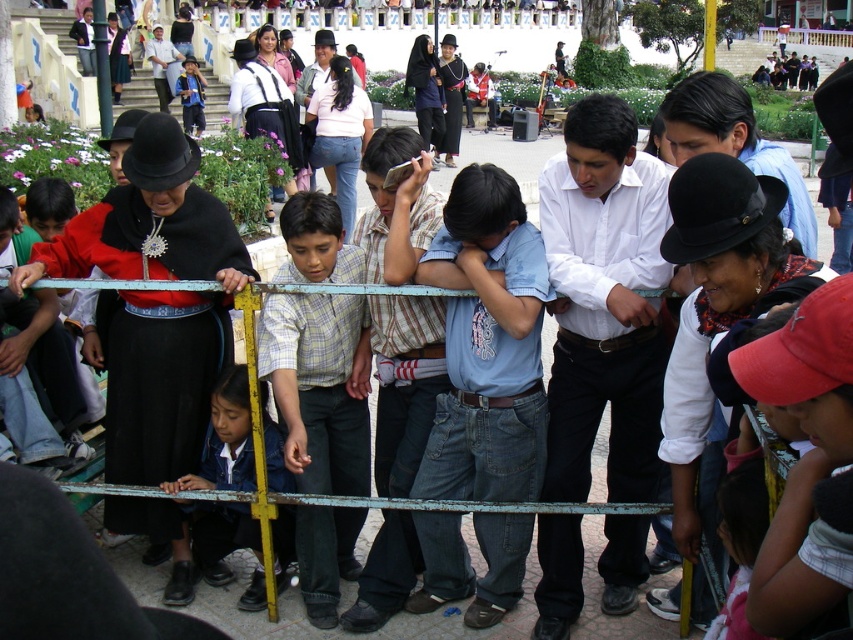
Is white shirt at upper center smaller than blue denim jacket at center?

Actually, white shirt at upper center might be larger than blue denim jacket at center.

At what (x,y) coordinates should I click in order to perform the action: click on white shirt at upper center. Please return your answer as a coordinate pair (x, y). The height and width of the screenshot is (640, 853). Looking at the image, I should click on (161, 65).

Who is lower down, denim jeans at center or red cap at lower right?

red cap at lower right is lower down.

Is point (456, 355) in front of point (820, 342)?

That is False.

This screenshot has width=853, height=640. Find the location of `denim jeans at center`. denim jeans at center is located at coordinates (486, 346).

In the scene shown: Who is shorter, blue school uniform at lower left or white shirt at upper center?

blue school uniform at lower left

Does blue school uniform at lower left have a lesser width compared to white shirt at upper center?

Yes, blue school uniform at lower left is thinner than white shirt at upper center.

Is point (248, 512) in front of point (157, 77)?

Yes, point (248, 512) is in front of point (157, 77).

Where is `blue school uniform at lower left`? blue school uniform at lower left is located at coordinates (225, 440).